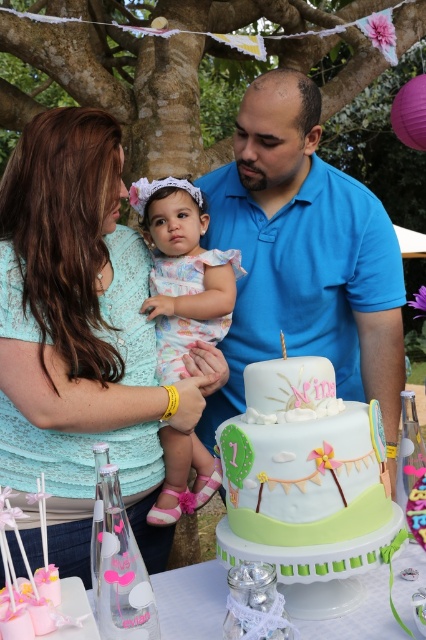
You are a photographer at the birthday celebration. You want to take a photo of the pastel fondant cake at center and the pastel floral dress at center without any obstructions. Based on their positions, which one should be moved to ensure both are fully visible in the photo?

The pastel fondant cake at center is in front of the pastel floral dress at center. To ensure both are fully visible, the cake should be moved slightly backward or the dress moved forward so they are not overlapping in the photo.

You are planning to take a photo of the matte teal lace dress at upper left and the pastel fondant cake at center. Which object should you focus on first if you want to capture both in the frame without moving the camera?

You should focus on the matte teal lace dress at upper left first because it is wider than the pastel fondant cake at center, so positioning it properly will ensure both fit in the frame.